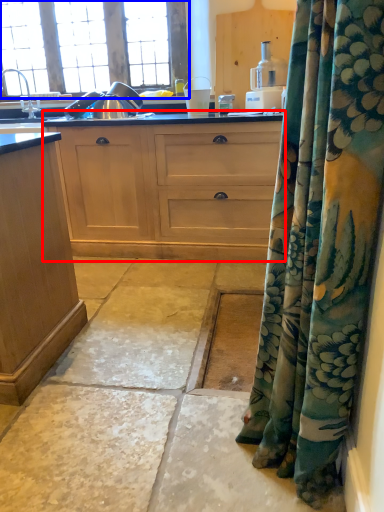
Question: Which of the following is the farthest to the observer, cabinetry (highlighted by a red box) or window (highlighted by a blue box)?

Choices:
 (A) cabinetry
 (B) window

Answer: (B)